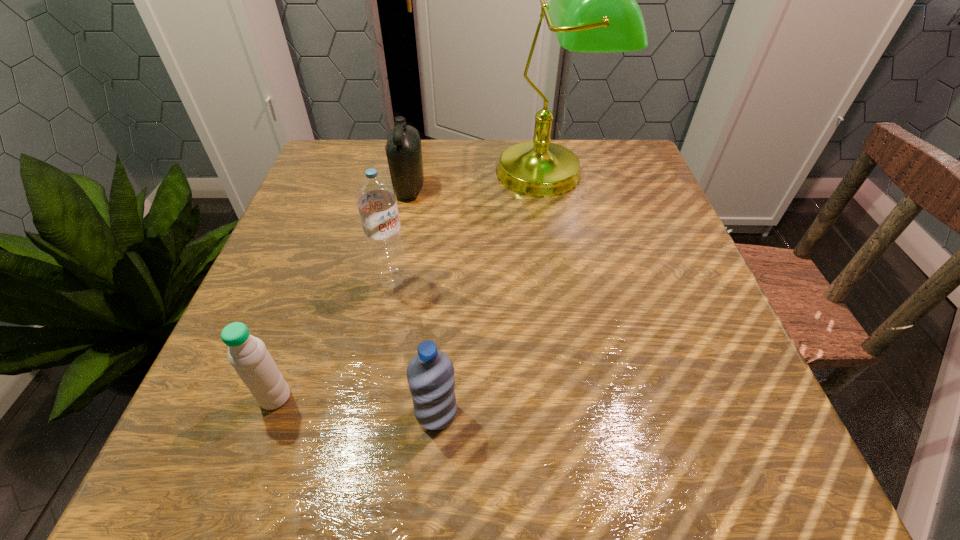
At what (x,y) coordinates should I click in order to perform the action: click on the rightmost object. Please return your answer as a coordinate pair (x, y). Image resolution: width=960 pixels, height=540 pixels. Looking at the image, I should click on (593, 8).

The image size is (960, 540). In order to click on lamp in this screenshot , I will do `click(593, 8)`.

This screenshot has height=540, width=960. Find the location of `the tallest water bottle`. the tallest water bottle is located at coordinates (376, 198).

This screenshot has height=540, width=960. I want to click on the third farthest object, so click(x=376, y=198).

At what (x,y) coordinates should I click in order to perform the action: click on bottle. Please return your answer as a coordinate pair (x, y). Looking at the image, I should click on (403, 149).

At what (x,y) coordinates should I click in order to perform the action: click on the leftmost water bottle. Please return your answer as a coordinate pair (x, y). Looking at the image, I should click on (248, 355).

The height and width of the screenshot is (540, 960). Find the location of `the rightmost water bottle`. the rightmost water bottle is located at coordinates click(430, 374).

The width and height of the screenshot is (960, 540). Find the location of `vacant space located 0.380m on the desk next to the lamp`. vacant space located 0.380m on the desk next to the lamp is located at coordinates (585, 354).

The height and width of the screenshot is (540, 960). I want to click on vacant area situated 0.220m on the left of the second water bottle from left to right, so click(258, 279).

Identify the location of free space located on the right of the bottle. (493, 189).